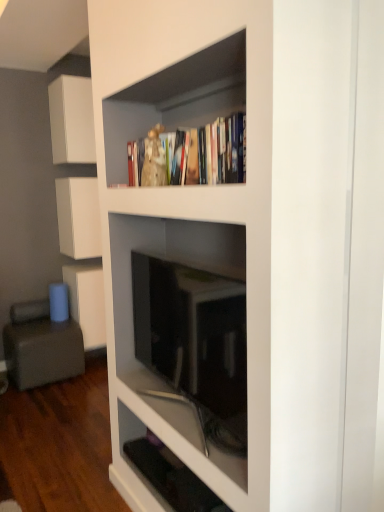
Question: Could you tell me if gray fabric armchair at lower left is facing matte black tv at center, marked as the 2th shelf in a bottom-to-top arrangement?

Choices:
 (A) yes
 (B) no

Answer: (A)

Question: From a real-world perspective, is gray fabric armchair at lower left positioned under matte black tv at center, which ranks as the 1th shelf in top-to-bottom order, based on gravity?

Choices:
 (A) yes
 (B) no

Answer: (A)

Question: Is gray fabric armchair at lower left closer to camera compared to matte black tv at center, marked as the 2th shelf in a bottom-to-top arrangement?

Choices:
 (A) no
 (B) yes

Answer: (A)

Question: Can you confirm if gray fabric armchair at lower left is positioned to the right of matte black tv at center, which ranks as the 1th shelf in top-to-bottom order?

Choices:
 (A) yes
 (B) no

Answer: (B)

Question: Is gray fabric armchair at lower left located outside matte black tv at center, marked as the 2th shelf in a bottom-to-top arrangement?

Choices:
 (A) yes
 (B) no

Answer: (A)

Question: Would you say black glossy shelf at lower center, positioned as the 1th shelf in bottom-to-top order, is to the left or to the right of matte black tv at center, which ranks as the 1th shelf in top-to-bottom order, in the picture?

Choices:
 (A) left
 (B) right

Answer: (A)

Question: Is black glossy shelf at lower center, the second shelf viewed from the top, situated inside matte black tv at center, marked as the 2th shelf in a bottom-to-top arrangement, or outside?

Choices:
 (A) outside
 (B) inside

Answer: (A)

Question: Is point click(172, 471) closer or farther from the camera than point click(125, 276)?

Choices:
 (A) closer
 (B) farther

Answer: (A)

Question: From their relative heights in the image, would you say black glossy shelf at lower center, positioned as the 1th shelf in bottom-to-top order, is taller or shorter than matte black tv at center, marked as the 2th shelf in a bottom-to-top arrangement?

Choices:
 (A) tall
 (B) short

Answer: (B)

Question: Visually, is gray fabric armchair at lower left positioned to the left or to the right of white matte cabinet at upper left, which is the third cabinetry from bottom to top?

Choices:
 (A) left
 (B) right

Answer: (A)

Question: From a real-world perspective, is gray fabric armchair at lower left physically located above or below white matte cabinet at upper left, which is the third cabinetry from bottom to top?

Choices:
 (A) above
 (B) below

Answer: (B)

Question: From their relative heights in the image, would you say gray fabric armchair at lower left is taller or shorter than white matte cabinet at upper left, the 1th cabinetry viewed from the top?

Choices:
 (A) short
 (B) tall

Answer: (A)

Question: Is gray fabric armchair at lower left inside or outside of white matte cabinet at upper left, the 1th cabinetry viewed from the top?

Choices:
 (A) inside
 (B) outside

Answer: (B)

Question: Considering the positions of point (223, 456) and point (77, 329), is point (223, 456) closer or farther from the camera than point (77, 329)?

Choices:
 (A) farther
 (B) closer

Answer: (B)

Question: Is matte black tv at center, which ranks as the 1th shelf in top-to-bottom order, taller or shorter than gray fabric armchair at lower left?

Choices:
 (A) short
 (B) tall

Answer: (B)